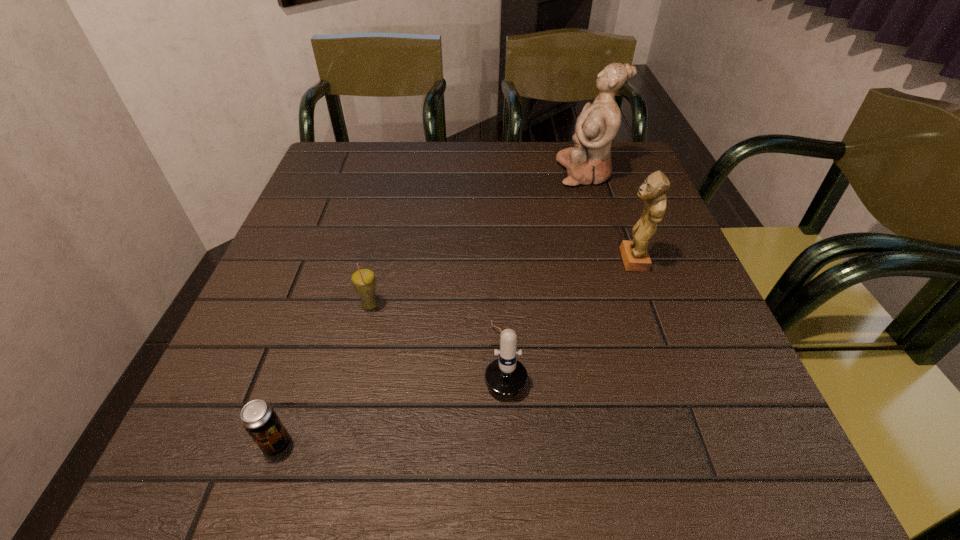
Identify which object is located as the fourth nearest to the farthest object. Please provide its 2D coordinates. Your answer should be formatted as a tuple, i.e. [(x, y)], where the tuple contains the x and y coordinates of a point satisfying the conditions above.

[(259, 419)]

Image resolution: width=960 pixels, height=540 pixels. I want to click on the closest object to the second nearest object, so click(363, 279).